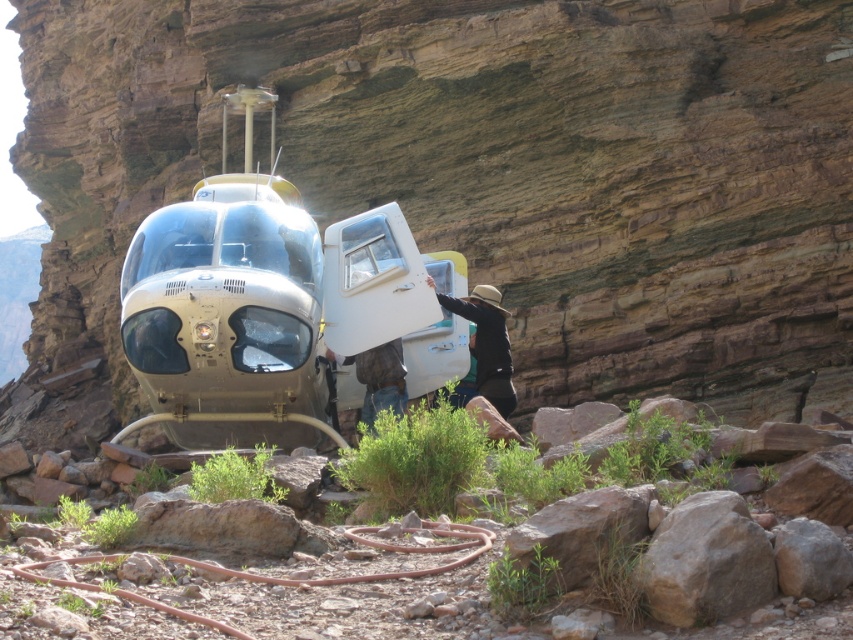
Question: Is brown straw hat at center wider than brown leather jacket at center?

Choices:
 (A) no
 (B) yes

Answer: (A)

Question: Which point is closer to the camera taking this photo?

Choices:
 (A) (495, 380)
 (B) (383, 90)
 (C) (339, 240)
 (D) (699, 538)

Answer: (D)

Question: Can you confirm if matte white helicopter at center is smaller than brown leather jacket at center?

Choices:
 (A) no
 (B) yes

Answer: (A)

Question: Considering the real-world distances, which object is farthest from the metallic silver helicopter at center?

Choices:
 (A) brown straw hat at center
 (B) matte white helicopter at center
 (C) gray rough rock at center
 (D) brown leather jacket at center

Answer: (C)

Question: Can you confirm if matte white helicopter at center is positioned above metallic silver helicopter at center?

Choices:
 (A) no
 (B) yes

Answer: (B)

Question: Estimate the real-world distances between objects in this image. Which object is closer to the brown leather jacket at center?

Choices:
 (A) gray rough rock at center
 (B) metallic silver helicopter at center
 (C) matte white helicopter at center

Answer: (B)